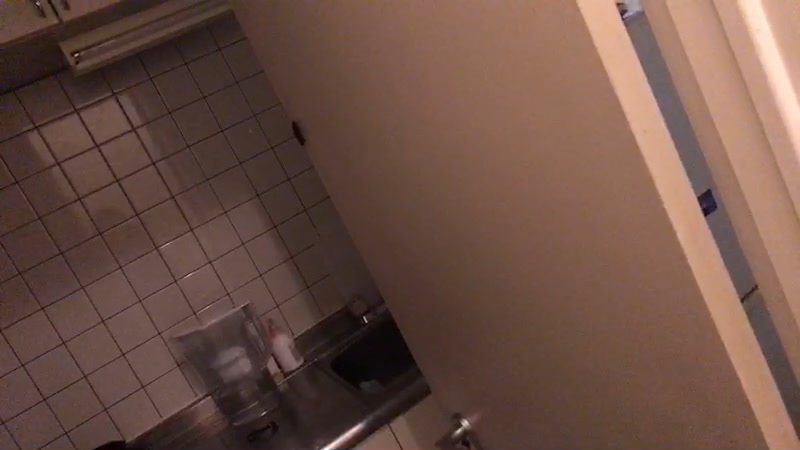
In order to click on fluorescent light in this screenshot , I will do `click(121, 40)`.